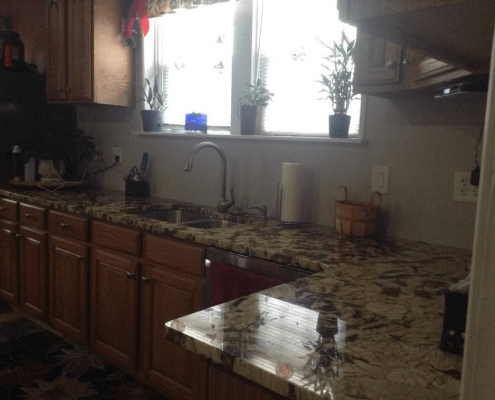
Identify the location of dishwasher. The image size is (495, 400). (248, 276).